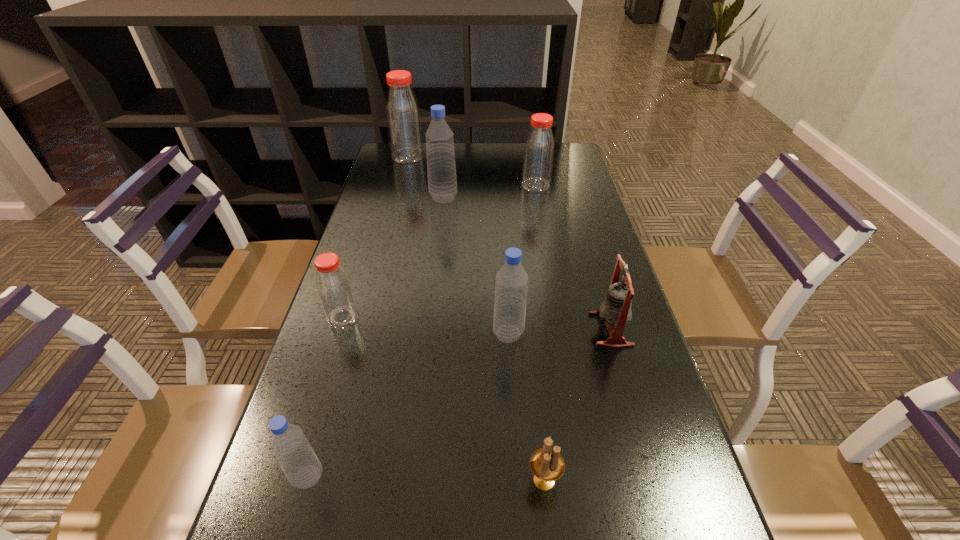
Where is `free region located 0.170m on the left of the candle holder`? The width and height of the screenshot is (960, 540). free region located 0.170m on the left of the candle holder is located at coordinates coord(429,481).

Identify the location of object present at the far edge. (x=403, y=118).

Locate an element on the screen. The width and height of the screenshot is (960, 540). bottle present at the right edge is located at coordinates (538, 156).

Identify the location of bell located at the right edge. The image size is (960, 540). (616, 308).

I want to click on object present at the far left corner, so click(403, 118).

Locate an element on the screen. vacant space at the far edge of the desktop is located at coordinates [523, 152].

The width and height of the screenshot is (960, 540). What are the coordinates of `free space at the left edge of the desktop` in the screenshot? It's located at (321, 482).

Where is `vacant space at the right edge of the desktop`? Image resolution: width=960 pixels, height=540 pixels. vacant space at the right edge of the desktop is located at coordinates pyautogui.click(x=653, y=399).

At what (x,y) coordinates should I click in order to perform the action: click on vacant region at the far left corner of the desktop. Please return your answer as a coordinate pair (x, y). This screenshot has width=960, height=540. Looking at the image, I should click on (376, 165).

Identify the location of empty space between the nearest red bottle and the second farthest red bottle. The width and height of the screenshot is (960, 540). (440, 251).